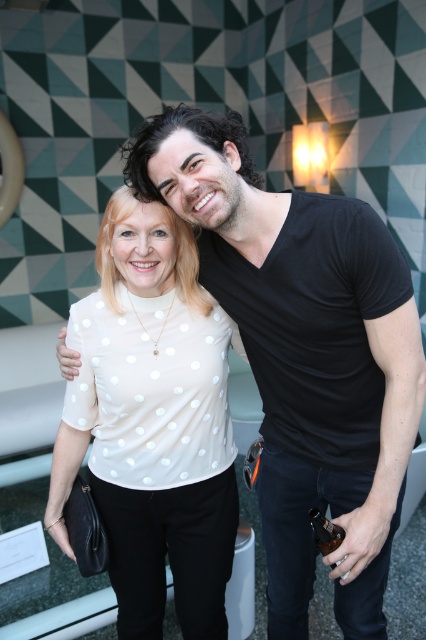
You are a photographer adjusting the lighting for a photo shoot. You notice two people in the scene wearing white dotted tops. The tops are described as a white dotted shirt at center and a white dotted blouse at center. Which of these two tops is closer to the camera?

The white dotted shirt at center is closer to the camera because it is in front of the white dotted blouse at center.